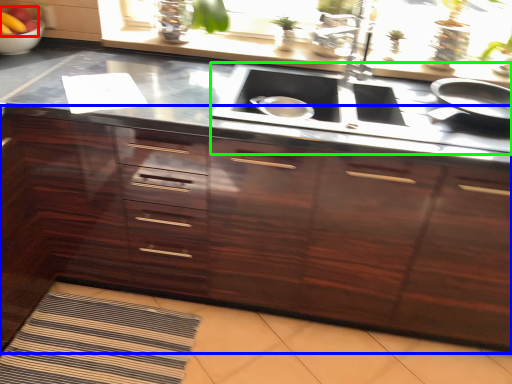
Question: Considering the real-world distances, which object is closest to fruit (highlighted by a red box)? cabinetry (highlighted by a blue box) or stove (highlighted by a green box).

Choices:
 (A) cabinetry
 (B) stove

Answer: (A)